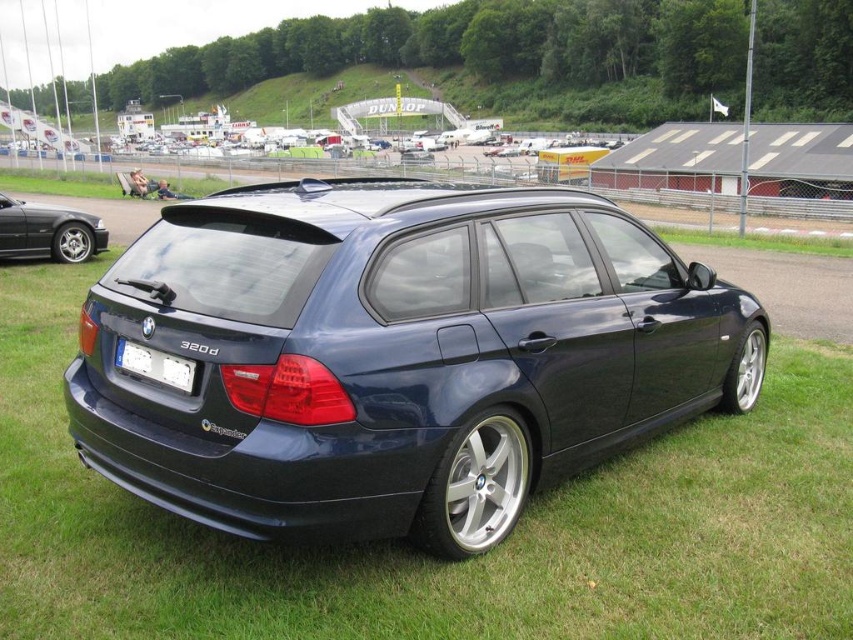
Does satin dark blue wagon at center appear on the left side of white plastic license plate at center?

In fact, satin dark blue wagon at center is to the right of white plastic license plate at center.

The height and width of the screenshot is (640, 853). Describe the element at coordinates (396, 355) in the screenshot. I see `satin dark blue wagon at center` at that location.

Where is `satin dark blue wagon at center`? The image size is (853, 640). satin dark blue wagon at center is located at coordinates (396, 355).

I want to click on satin dark blue wagon at center, so click(396, 355).

Measure the distance between shiny black car at left and camera.

37.00 feet

Between point (97, 244) and point (158, 372), which one is positioned in front?

Point (158, 372) is more forward.

Locate an element on the screen. shiny black car at left is located at coordinates (48, 230).

Can you confirm if satin dark blue wagon at center is positioned below matte black car at center?

Yes.

Does satin dark blue wagon at center appear over matte black car at center?

No, satin dark blue wagon at center is not above matte black car at center.

At what (x,y) coordinates should I click in order to perform the action: click on satin dark blue wagon at center. Please return your answer as a coordinate pair (x, y). This screenshot has height=640, width=853. Looking at the image, I should click on (396, 355).

Identify the location of satin dark blue wagon at center. The height and width of the screenshot is (640, 853). (396, 355).